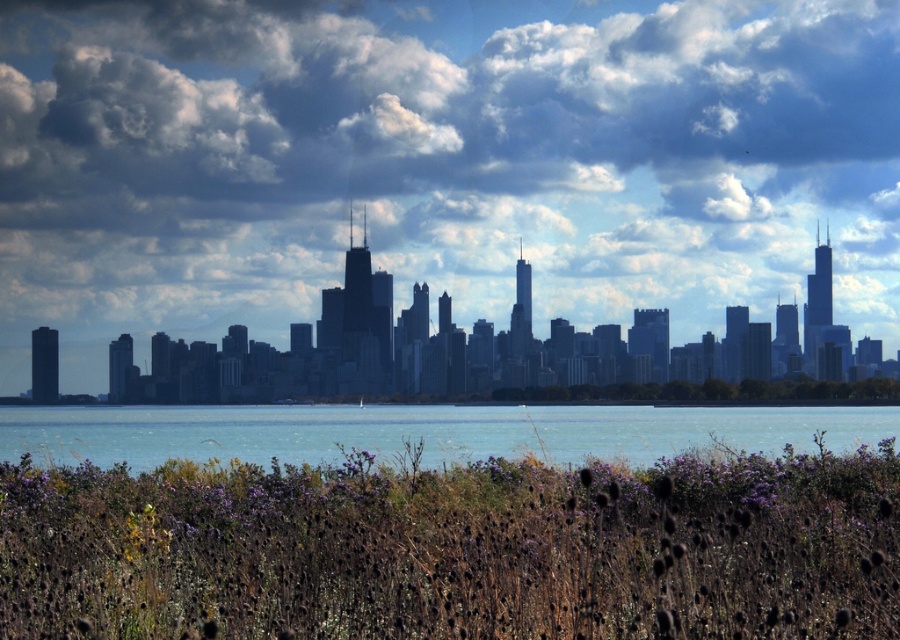
You are a photographer planning to capture the purple dry grass at lower center and the blue water at center in the same frame. Based on their sizes in the image, which object would appear more prominent in the photo?

The blue water at center would appear more prominent in the photo because it is larger than the purple dry grass at lower center.

You are standing at point A located at coordinates point A at (882, 556). You want to walk to point B, which is 48.58 feet away from you. Is there enough space to walk directly to point B without obstacles?

Yes, there is enough space to walk directly to point B because the scene describes a field of wildflowers and grasses in the foreground with a calm body of water in the middle ground, and no obstacles are mentioned between the points.